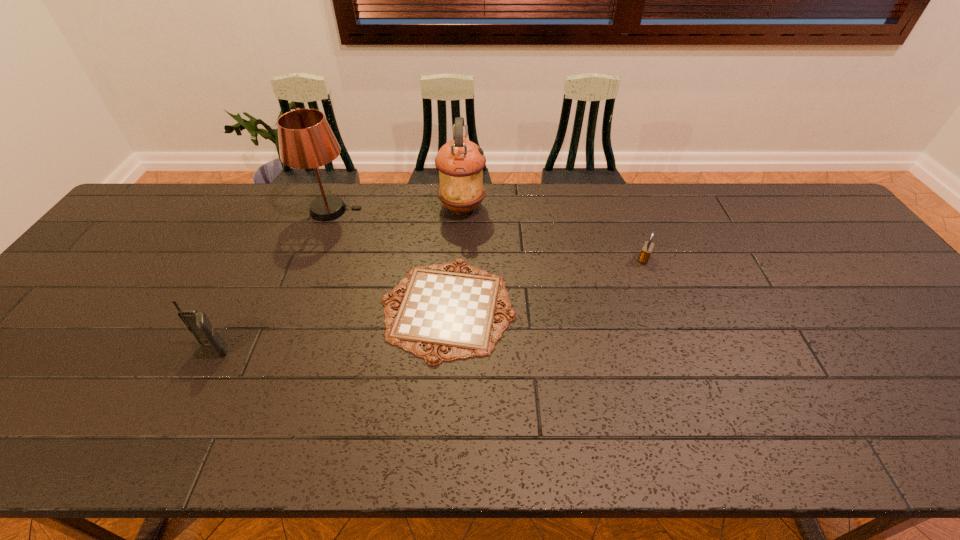
Locate which object is the closest to the cellular telephone. Please provide its 2D coordinates. Your answer should be formatted as a tuple, i.e. [(x, y)], where the tuple contains the x and y coordinates of a point satisfying the conditions above.

[(441, 310)]

You are a GUI agent. You are given a task and a screenshot of the screen. Output one action in this format:
    pyautogui.click(x=<x>, y=<y>)
    Task: Click on the free space that satisfies the following two spatial constraints: 1. on the front-facing side of the second object from left to right; 2. on the left side of the chessboard
    This screenshot has height=540, width=960.
    Given the screenshot: What is the action you would take?
    pyautogui.click(x=294, y=308)

This screenshot has height=540, width=960. I want to click on free space that satisfies the following two spatial constraints: 1. on the front-facing side of the padlock; 2. on the right side of the lampshade, so click(313, 259).

Find the location of a particular element. This screenshot has width=960, height=540. free space that satisfies the following two spatial constraints: 1. on the front-facing side of the lampshade; 2. on the keyboard of the cellular telephone is located at coordinates (278, 350).

The height and width of the screenshot is (540, 960). What are the coordinates of `free space in the image that satisfies the following two spatial constraints: 1. on the front-facing side of the lampshade; 2. on the right side of the chessboard` in the screenshot? It's located at (294, 308).

Find the location of a particular element. vacant space that satisfies the following two spatial constraints: 1. on the back side of the shortest object; 2. on the right side of the second shortest object is located at coordinates (451, 259).

The image size is (960, 540). What are the coordinates of `vacant region that satisfies the following two spatial constraints: 1. on the front-facing side of the fourth object from right to left; 2. on the keyboard of the cellular telephone` in the screenshot? It's located at (278, 350).

This screenshot has height=540, width=960. What are the coordinates of `vacant area in the image that satisfies the following two spatial constraints: 1. on the front-facing side of the lampshade; 2. on the left side of the chessboard` in the screenshot? It's located at (294, 308).

This screenshot has height=540, width=960. Find the location of `vacant area that satisfies the following two spatial constraints: 1. on the front-facing side of the lampshade; 2. on the right side of the second shortest object`. vacant area that satisfies the following two spatial constraints: 1. on the front-facing side of the lampshade; 2. on the right side of the second shortest object is located at coordinates (313, 259).

Where is `free space that satisfies the following two spatial constraints: 1. on the front-facing side of the shortest object; 2. on the left side of the fourth object from right to left`? Image resolution: width=960 pixels, height=540 pixels. free space that satisfies the following two spatial constraints: 1. on the front-facing side of the shortest object; 2. on the left side of the fourth object from right to left is located at coordinates (294, 308).